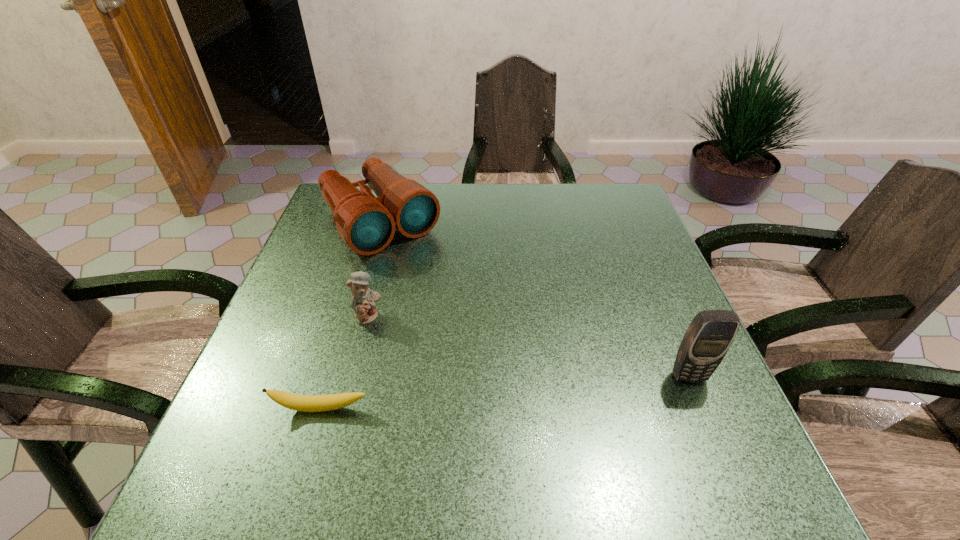
Where is `banana`? This screenshot has height=540, width=960. banana is located at coordinates (305, 403).

Locate an element on the screen. The width and height of the screenshot is (960, 540). the nearest object is located at coordinates (305, 403).

You are a GUI agent. You are given a task and a screenshot of the screen. Output one action in this format:
    pyautogui.click(x=<x>, y=<y>)
    Task: Click on the second nearest object
    Image resolution: width=960 pixels, height=540 pixels.
    Given the screenshot: What is the action you would take?
    pyautogui.click(x=705, y=343)

The height and width of the screenshot is (540, 960). Identify the location of the tallest object. 705,343.

Find the location of a particular element. the third nearest object is located at coordinates (363, 300).

Where is `teddy bear`? Image resolution: width=960 pixels, height=540 pixels. teddy bear is located at coordinates (363, 300).

Where is `binoculars`? The image size is (960, 540). binoculars is located at coordinates (x=367, y=223).

At what (x,y) coordinates should I click in order to perform the action: click on the third shortest object. Please return your answer as a coordinate pair (x, y). The image size is (960, 540). Looking at the image, I should click on (367, 223).

Identify the location of vacant space located on the front face of the tallest object. (708, 422).

Locate an element on the screen. The height and width of the screenshot is (540, 960). vacant region located on the front-facing side of the second shortest object is located at coordinates (393, 336).